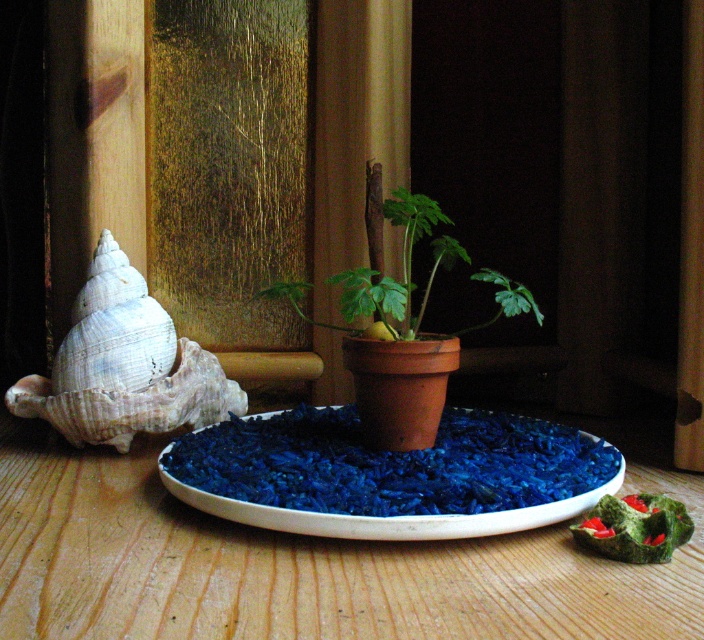
Question: Which of these objects is positioned farthest from the white shell at left?

Choices:
 (A) white ceramic plate at center
 (B) green matte terracotta pot at center
 (C) white ceramic platter at center
 (D) green fuzzy plant at center

Answer: (D)

Question: Can you confirm if white ceramic plate at center is positioned to the left of green fuzzy plant at center?

Choices:
 (A) no
 (B) yes

Answer: (B)

Question: Can you confirm if white ceramic plate at center is positioned above white shell at left?

Choices:
 (A) no
 (B) yes

Answer: (A)

Question: Which point appears farthest from the camera in this image?

Choices:
 (A) (629, 506)
 (B) (101, 496)
 (C) (427, 196)
 (D) (344, 536)

Answer: (C)

Question: Which point appears farthest from the camera in this image?

Choices:
 (A) (125, 369)
 (B) (515, 556)
 (C) (453, 522)
 (D) (590, 545)

Answer: (A)

Question: Is white shell at left thinner than green matte terracotta pot at center?

Choices:
 (A) no
 (B) yes

Answer: (B)